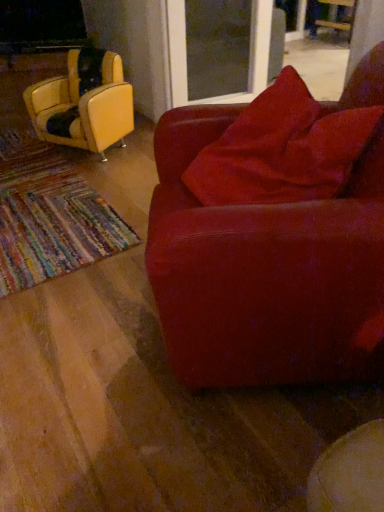
Question: Is the depth of suede-like red couch at center, which ranks as the second chair in left-to-right order, greater than that of transparent glass screen door at upper center?

Choices:
 (A) yes
 (B) no

Answer: (B)

Question: Considering the relative sizes of suede-like red couch at center, positioned as the second chair in right-to-left order, and transparent glass screen door at upper center in the image provided, is suede-like red couch at center, positioned as the second chair in right-to-left order, taller than transparent glass screen door at upper center?

Choices:
 (A) yes
 (B) no

Answer: (A)

Question: Is suede-like red couch at center, placed as the 1th chair when sorted from bottom to top, facing away from transparent glass screen door at upper center?

Choices:
 (A) no
 (B) yes

Answer: (A)

Question: Does suede-like red couch at center, positioned as the second chair in right-to-left order, appear on the right side of transparent glass screen door at upper center?

Choices:
 (A) yes
 (B) no

Answer: (B)

Question: Is suede-like red couch at center, marked as the 3th chair in a top-to-bottom arrangement, positioned beyond the bounds of transparent glass screen door at upper center?

Choices:
 (A) no
 (B) yes

Answer: (B)

Question: Does suede-like red couch at center, which is the 3th chair in back-to-front order, have a greater width compared to transparent glass screen door at upper center?

Choices:
 (A) no
 (B) yes

Answer: (A)

Question: Is leather yellow chair at left, placed as the 2th chair when sorted from back to front, located within wooden chair at upper right, acting as the 3th chair starting from the front?

Choices:
 (A) yes
 (B) no

Answer: (B)

Question: From a real-world perspective, is wooden chair at upper right, positioned as the third chair in bottom-to-top order, over leather yellow chair at left, placed as the 2th chair when sorted from back to front?

Choices:
 (A) yes
 (B) no

Answer: (B)

Question: Is the depth of wooden chair at upper right, the first chair from the top, greater than that of leather yellow chair at left, arranged as the third chair when viewed from the right?

Choices:
 (A) no
 (B) yes

Answer: (B)

Question: Is wooden chair at upper right, the first chair from the back, to the right of leather yellow chair at left, the 1th chair viewed from the left, from the viewer's perspective?

Choices:
 (A) yes
 (B) no

Answer: (A)

Question: From the image's perspective, would you say wooden chair at upper right, which ranks as the first chair in right-to-left order, is positioned over leather yellow chair at left, arranged as the third chair when viewed from the right?

Choices:
 (A) no
 (B) yes

Answer: (B)

Question: Is wooden chair at upper right, the first chair from the top, looking in the opposite direction of leather yellow chair at left, which is the second chair in front-to-back order?

Choices:
 (A) no
 (B) yes

Answer: (A)

Question: Is leather yellow chair at left, which is the second chair in front-to-back order, located outside wooden chair at upper right, positioned as the third chair in bottom-to-top order?

Choices:
 (A) no
 (B) yes

Answer: (B)